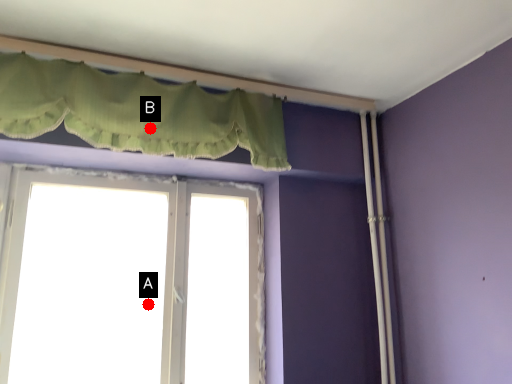
Question: Two points are circled on the image, labeled by A and B beside each circle. Which point is closer to the camera taking this photo?

Choices:
 (A) A is closer
 (B) B is closer

Answer: (B)